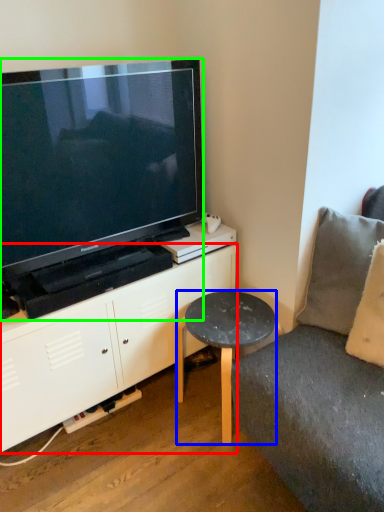
Question: Which object is positioned farthest from cabinetry (highlighted by a red box)? Select from table (highlighted by a blue box) and television (highlighted by a green box).

Choices:
 (A) table
 (B) television

Answer: (B)